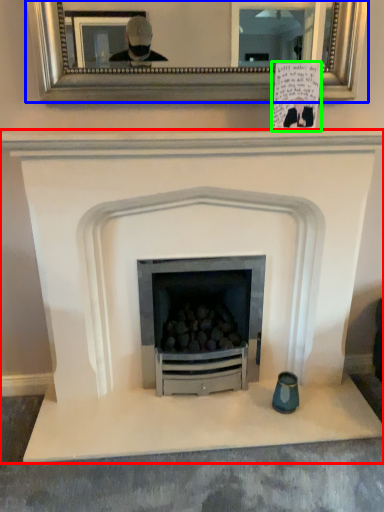
Question: Based on their relative distances, which object is farther from fireplace (highlighted by a red box)? Choose from picture frame (highlighted by a blue box) and postcard (highlighted by a green box).

Choices:
 (A) picture frame
 (B) postcard

Answer: (A)